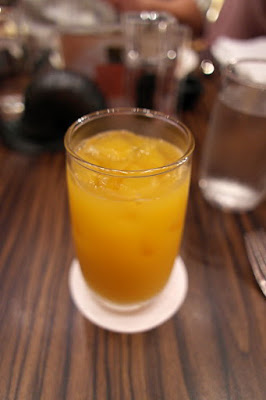
Image resolution: width=266 pixels, height=400 pixels. In order to click on glass in this screenshot , I will do `click(157, 57)`.